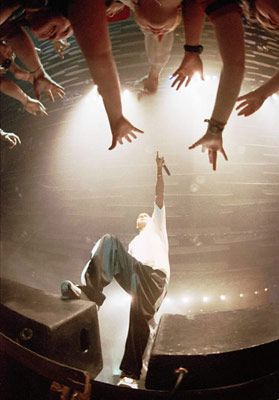
At what (x,y) coordinates should I click in order to perform the action: click on overhead light. Please return your answer as a coordinate pair (x, y). The image size is (279, 400). Looking at the image, I should click on (204, 299).